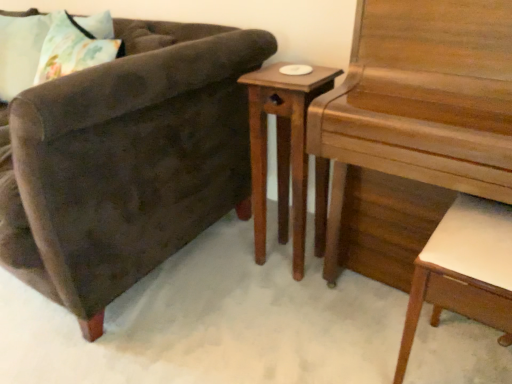
Find the location of a particular element. free spot behind white leather desk at lower right is located at coordinates (391, 309).